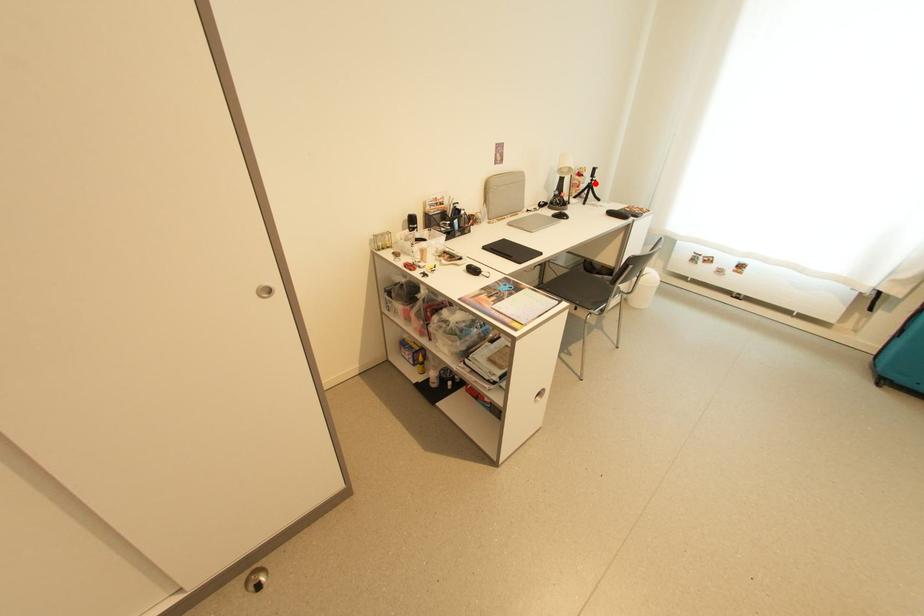
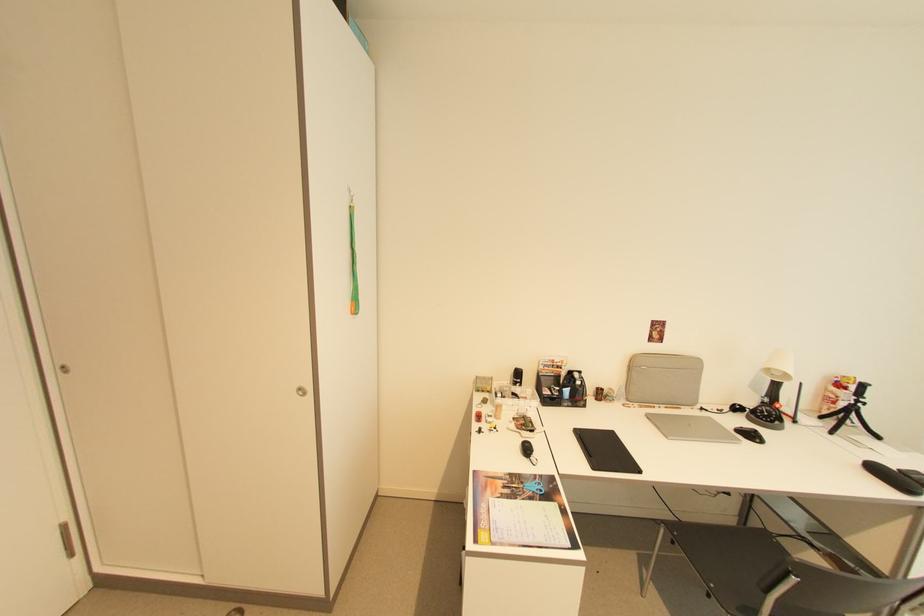
Locate, in the second image, the point that corresponds to the highlighted location in the first image.

(857, 405)